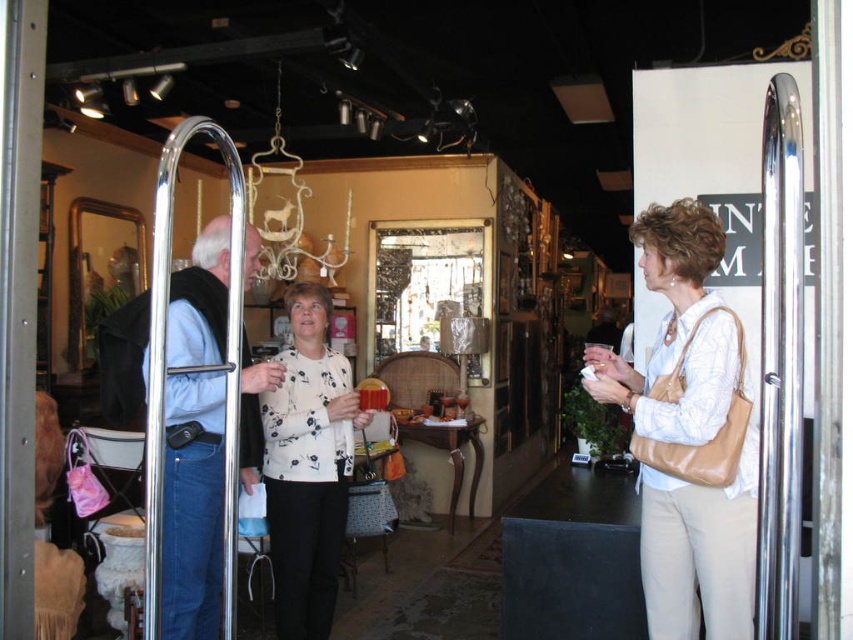
Question: Does beige leather purse at center have a greater width compared to white floral sweater at center?

Choices:
 (A) yes
 (B) no

Answer: (A)

Question: Can you confirm if beige leather purse at center is wider than polished chrome door at center?

Choices:
 (A) no
 (B) yes

Answer: (B)

Question: Which of these objects is positioned farthest from the beige leather purse at center?

Choices:
 (A) polished chrome door at center
 (B) white floral sweater at center

Answer: (B)

Question: Which object is farther from the camera taking this photo?

Choices:
 (A) beige leather purse at center
 (B) polished chrome door at center

Answer: (A)

Question: Where is white floral sweater at center located in relation to polished chrome door at center in the image?

Choices:
 (A) left
 (B) right

Answer: (B)

Question: Which object is positioned farthest from the white floral sweater at center?

Choices:
 (A) beige leather purse at center
 (B) polished chrome door at center

Answer: (A)